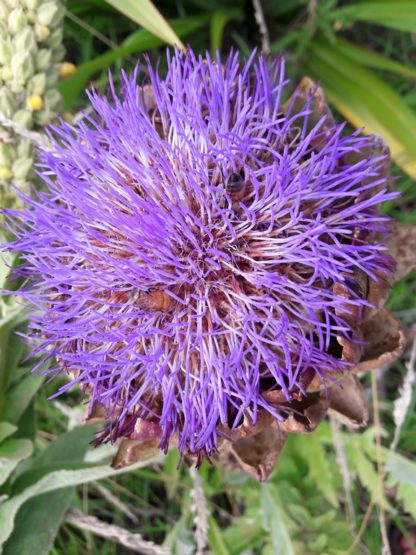
You are a GUI agent. You are given a task and a screenshot of the screen. Output one action in this format:
    pyautogui.click(x=<x>, y=<y>)
    Task: Click on the plant with buds
    The image size is (416, 555).
    Given the screenshot: What is the action you would take?
    pyautogui.click(x=10, y=102)